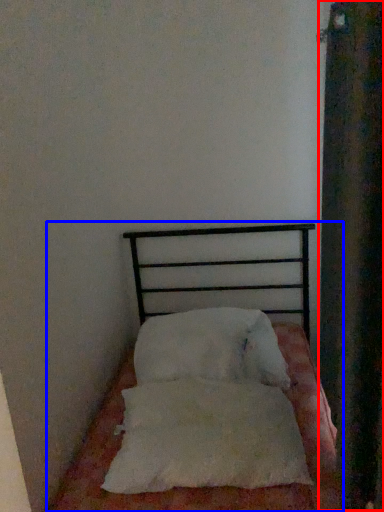
Question: Which object is further to the camera taking this photo, curtain (highlighted by a red box) or bed (highlighted by a blue box)?

Choices:
 (A) curtain
 (B) bed

Answer: (B)